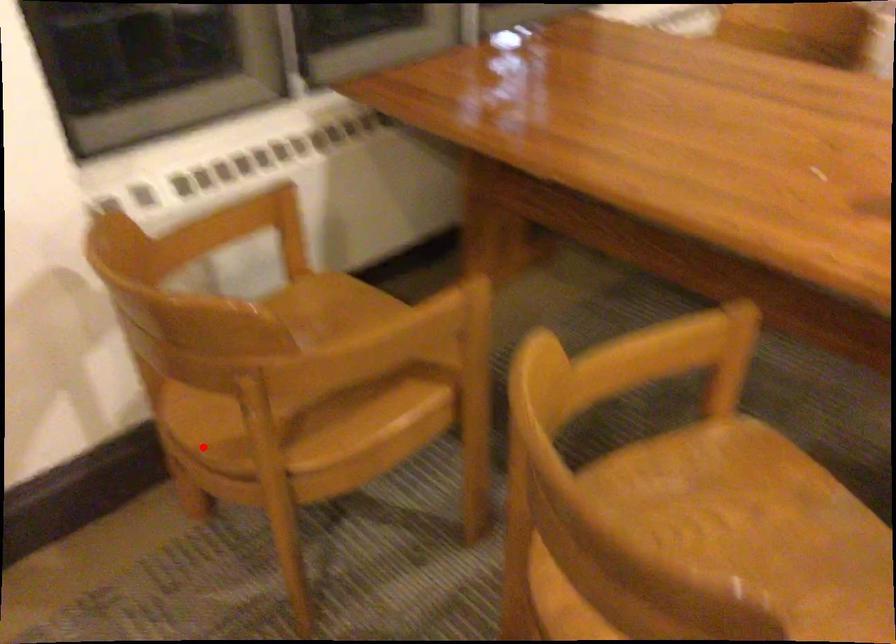
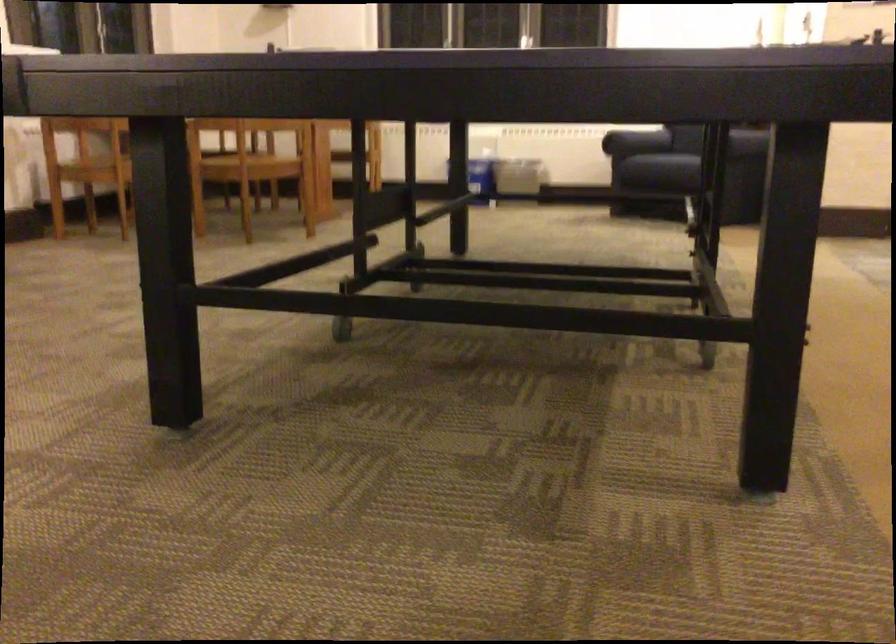
Question: I am providing you with two images of the same scene from different viewpoints. In image1, a red point is highlighted. Considering the same 3D point in image2, which of the following is correct?

Choices:
 (A) It is closer
 (B) It is farther

Answer: (B)